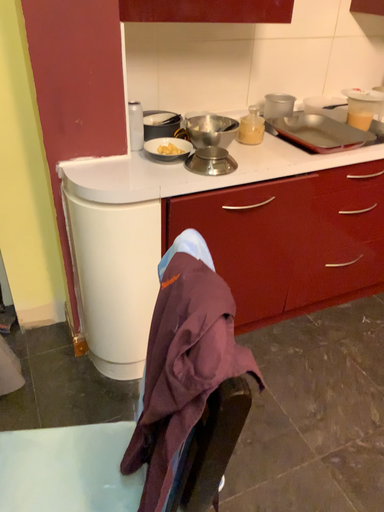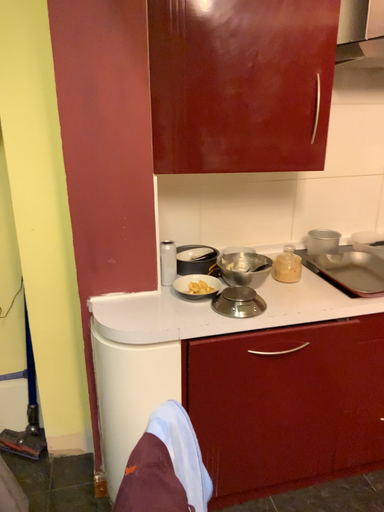
Question: How did the camera likely rotate when shooting the video?

Choices:
 (A) rotated right
 (B) rotated left

Answer: (B)